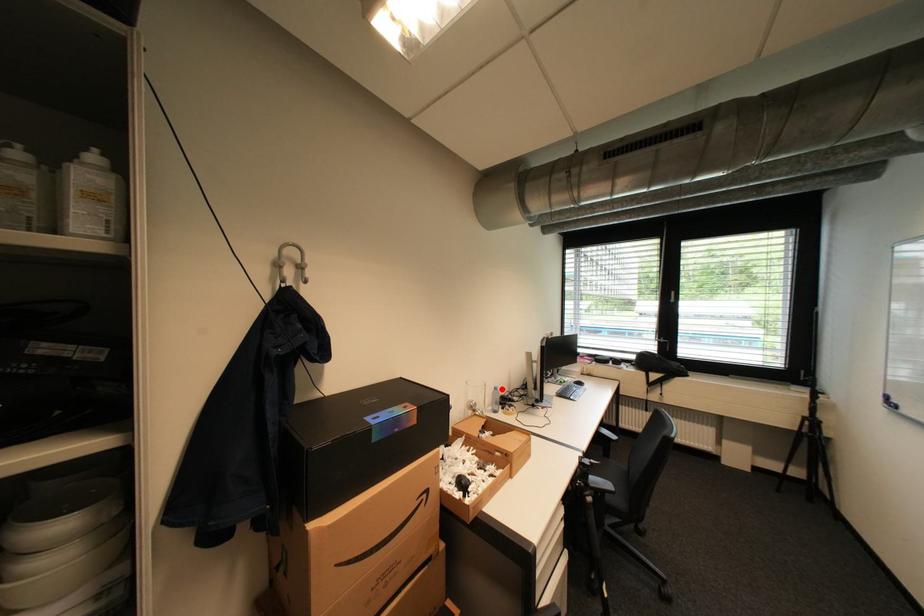
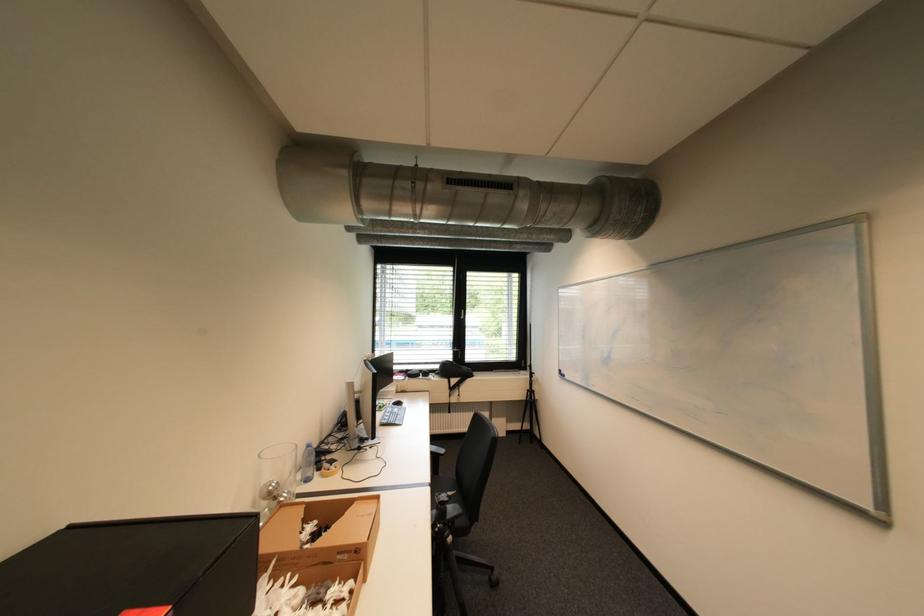
Question: A red point is marked in image1. In image2, is the corresponding 3D point closer to the camera or farther? Reply with the corresponding letter.

Choices:
 (A) The corresponding 3D point is closer.
 (B) The corresponding 3D point is farther.

Answer: (A)